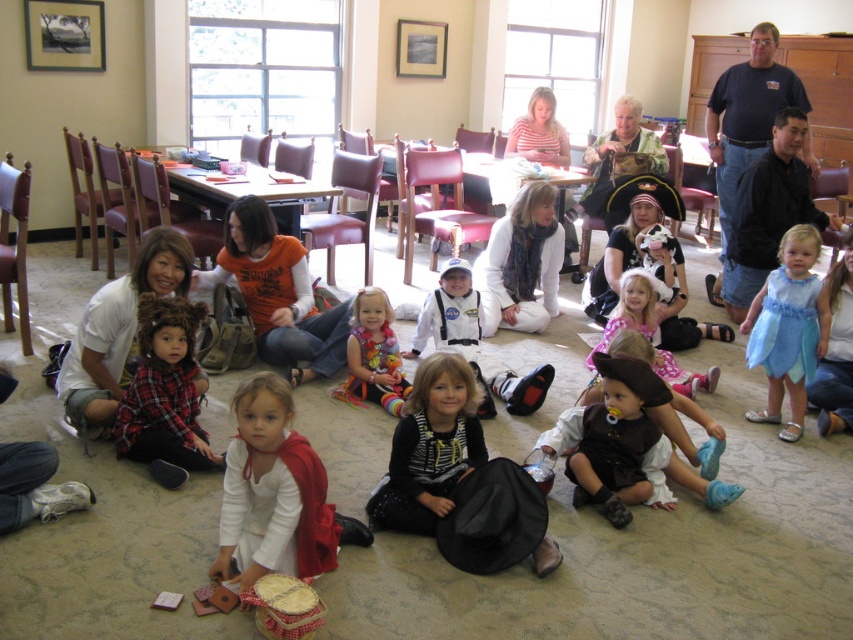
You are a photographer standing at the entrance of the room and want to take a photo of the orange cotton shirt at center and the plaid fabric shirt at lower left. Which shirt will appear closer to you in the photo?

The orange cotton shirt at center will appear closer to you in the photo because it is further to the viewer than the plaid fabric shirt at lower left.